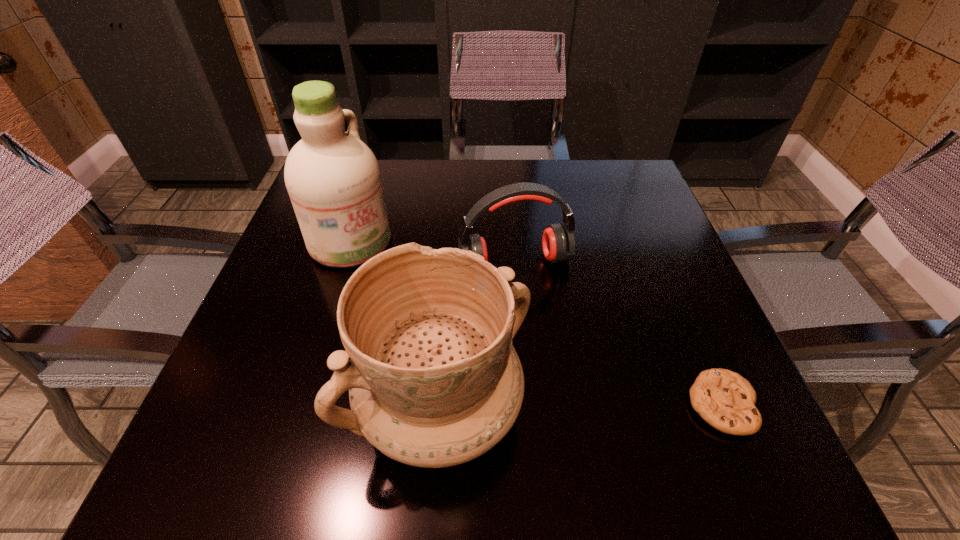
The width and height of the screenshot is (960, 540). Identify the location of the third shortest object. (434, 381).

The width and height of the screenshot is (960, 540). In order to click on cookie in this screenshot , I will do `click(724, 399)`.

Locate an element on the screen. The height and width of the screenshot is (540, 960). the shortest object is located at coordinates (724, 399).

The image size is (960, 540). In order to click on cleansing agent in this screenshot , I will do `click(333, 179)`.

What are the coordinates of `the tallest object` in the screenshot? It's located at (333, 179).

At what (x,y) coordinates should I click in order to perform the action: click on the second shortest object. Please return your answer as a coordinate pair (x, y). This screenshot has width=960, height=540. Looking at the image, I should click on (558, 242).

Identify the location of vacant space positioned 0.170m on the left of the pottery. (253, 408).

Find the location of `vacant area situated on the left of the cookie`. vacant area situated on the left of the cookie is located at coordinates (581, 404).

In order to click on free space located 0.370m on the front label of the tallest object in this screenshot , I will do `click(505, 349)`.

Where is `free space located on the front label of the tallest object`? This screenshot has height=540, width=960. free space located on the front label of the tallest object is located at coordinates (407, 281).